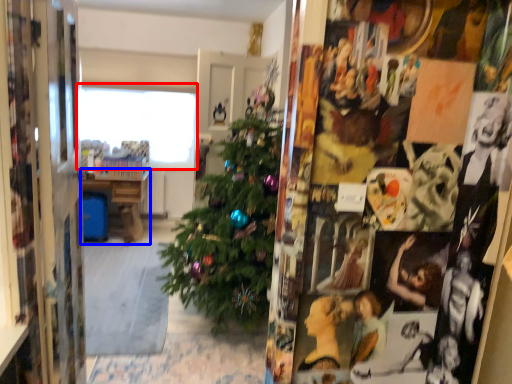
Question: Among these objects, which one is farthest to the camera, window (highlighted by a red box) or table (highlighted by a blue box)?

Choices:
 (A) window
 (B) table

Answer: (B)